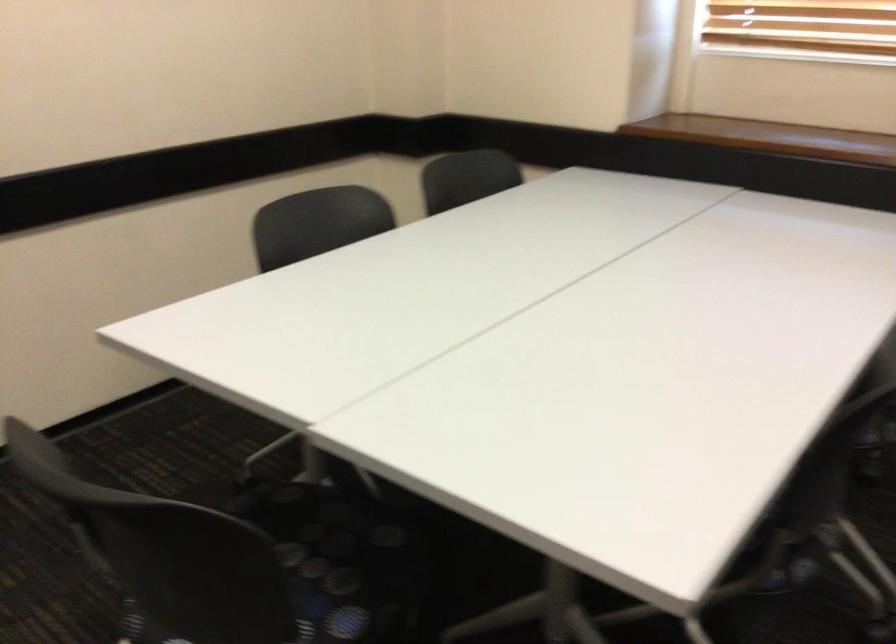
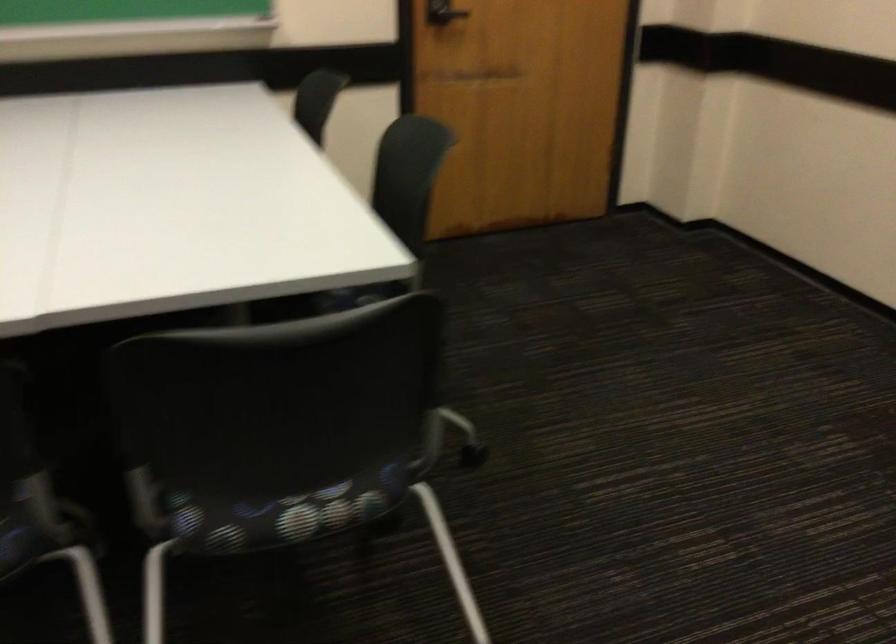
The first image is from the beginning of the video and the second image is from the end. How did the camera likely rotate when shooting the video?

The camera's rotation is toward left-down.